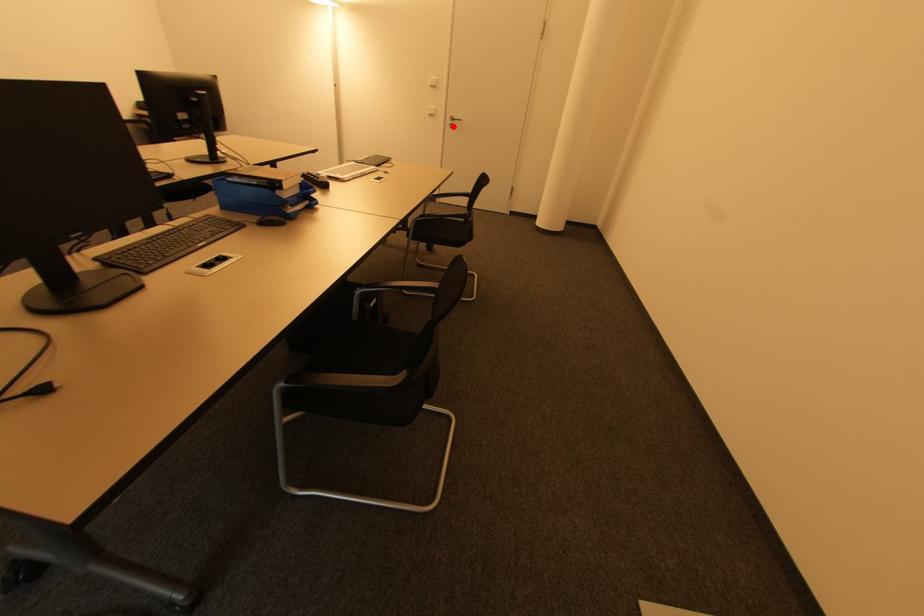
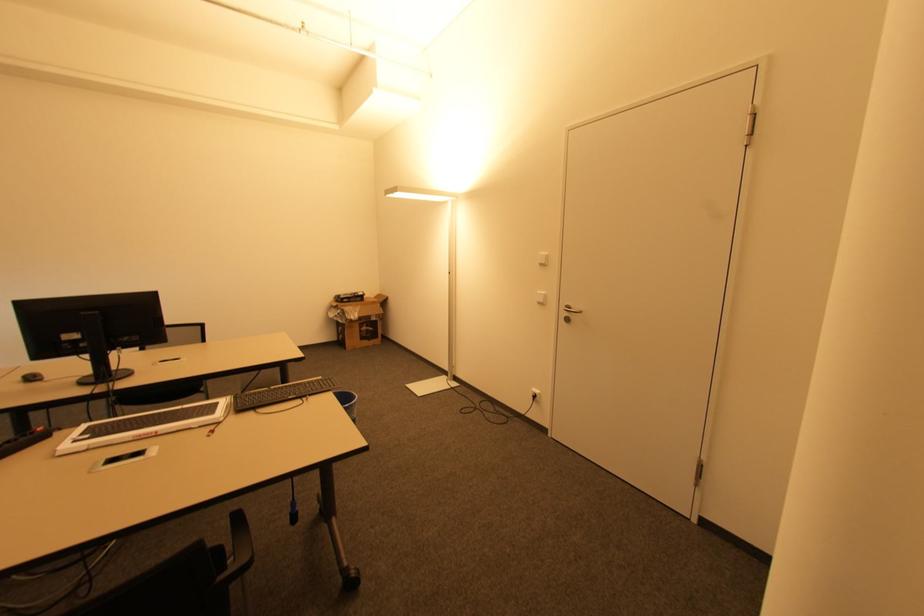
Locate, in the second image, the point that corresponds to the highlighted location in the first image.

(568, 320)